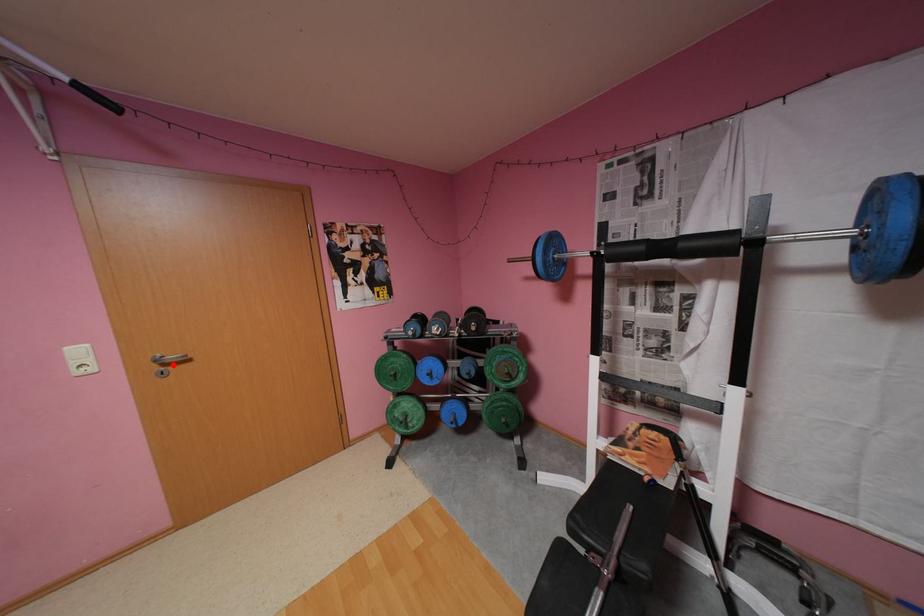
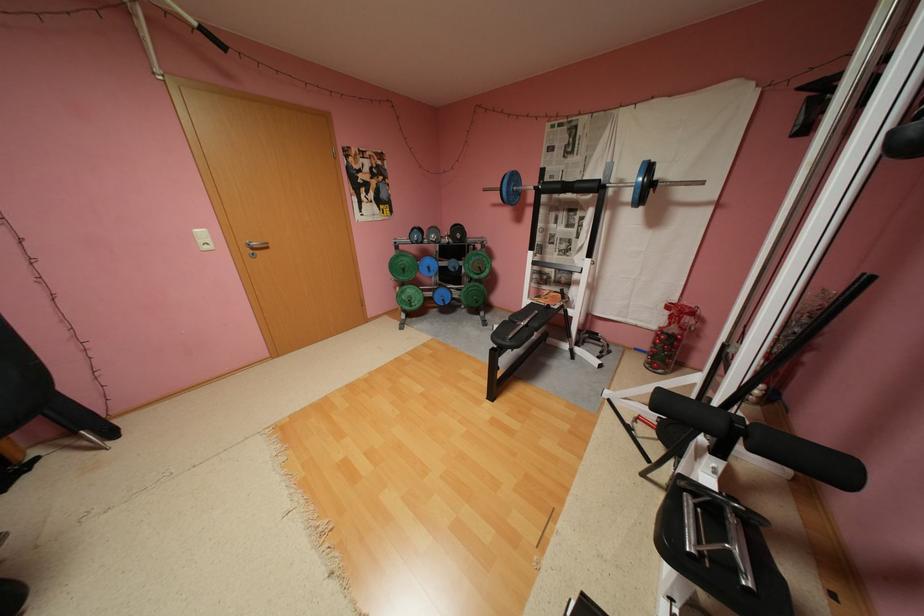
Locate, in the second image, the point that corresponds to the highlighted location in the first image.

(262, 249)